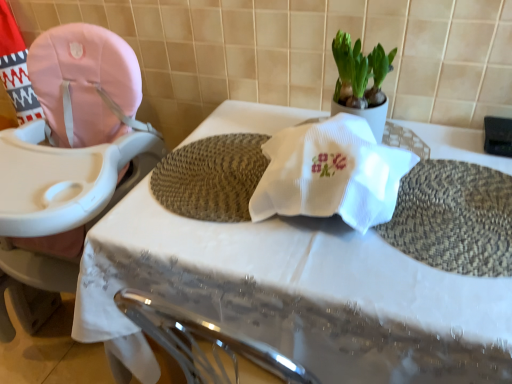
Question: Does white woven placemat at center appear on the left side of green leafy plant at upper center?

Choices:
 (A) yes
 (B) no

Answer: (A)

Question: Is white woven placemat at center far from green leafy plant at upper center?

Choices:
 (A) yes
 (B) no

Answer: (B)

Question: From the image's perspective, is white woven placemat at center below green leafy plant at upper center?

Choices:
 (A) no
 (B) yes

Answer: (B)

Question: Is white woven placemat at center in contact with green leafy plant at upper center?

Choices:
 (A) yes
 (B) no

Answer: (B)

Question: Is white woven placemat at center positioned with its back to green leafy plant at upper center?

Choices:
 (A) no
 (B) yes

Answer: (A)

Question: Relative to green leafy plant at upper center, is white woven placemat at center in front or behind?

Choices:
 (A) behind
 (B) front

Answer: (B)

Question: Does point (410, 342) appear closer or farther from the camera than point (356, 110)?

Choices:
 (A) closer
 (B) farther

Answer: (A)

Question: Is white woven placemat at center inside or outside of green leafy plant at upper center?

Choices:
 (A) outside
 (B) inside

Answer: (A)

Question: Considering the positions of white woven placemat at center and green leafy plant at upper center in the image, is white woven placemat at center taller or shorter than green leafy plant at upper center?

Choices:
 (A) short
 (B) tall

Answer: (B)

Question: In terms of size, does pink fabric baby carriage at left appear bigger or smaller than green leafy plant at upper center?

Choices:
 (A) big
 (B) small

Answer: (A)

Question: Is point (72, 273) positioned closer to the camera than point (361, 77)?

Choices:
 (A) farther
 (B) closer

Answer: (A)

Question: In the image, is pink fabric baby carriage at left positioned in front of or behind green leafy plant at upper center?

Choices:
 (A) behind
 (B) front

Answer: (B)

Question: From a real-world perspective, relative to green leafy plant at upper center, is pink fabric baby carriage at left vertically above or below?

Choices:
 (A) below
 (B) above

Answer: (A)

Question: From the image's perspective, relative to white woven placemat at center, is green leafy plant at upper center above or below?

Choices:
 (A) below
 (B) above

Answer: (B)

Question: From a real-world perspective, relative to white woven placemat at center, is green leafy plant at upper center vertically above or below?

Choices:
 (A) above
 (B) below

Answer: (A)